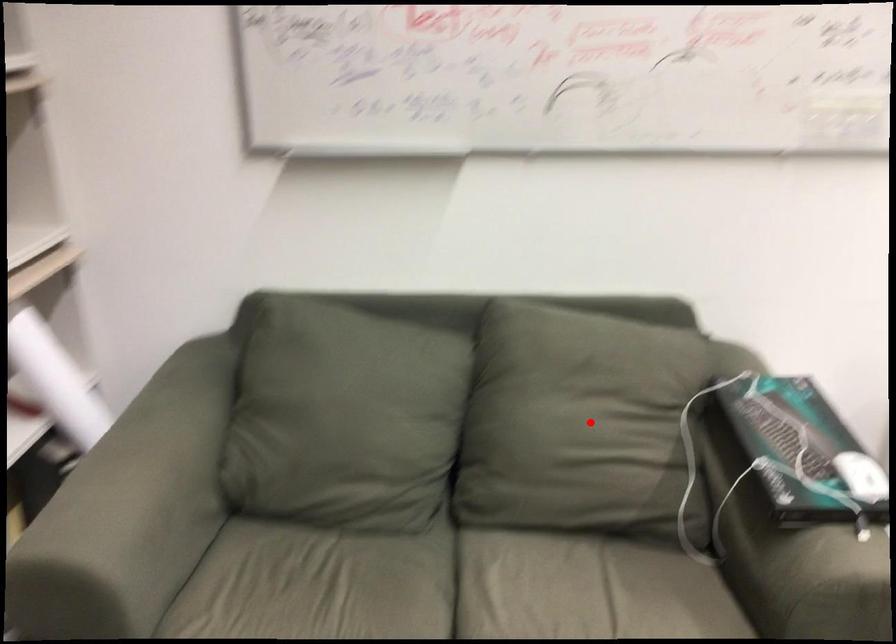
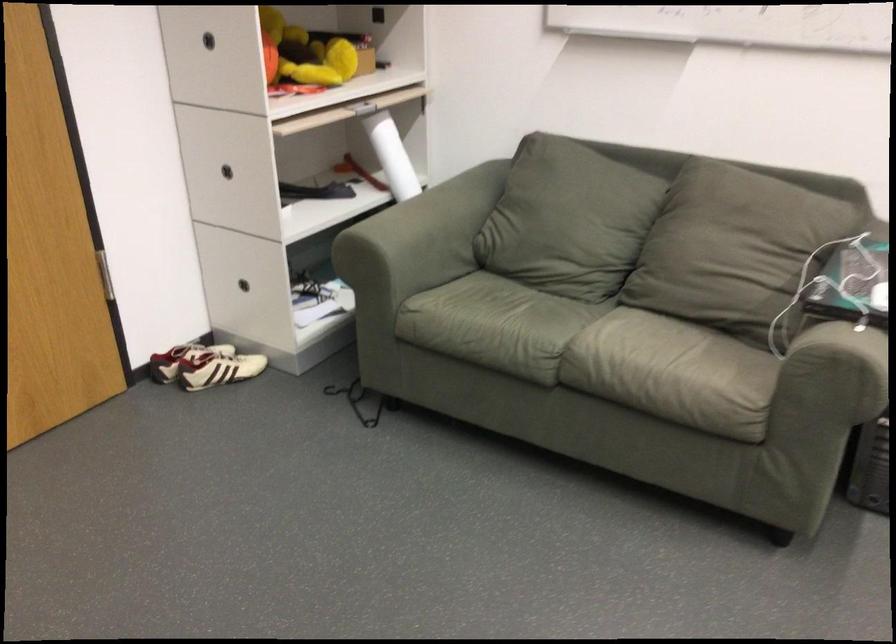
In the second image, find the point that corresponds to the highlighted location in the first image.

(728, 243)